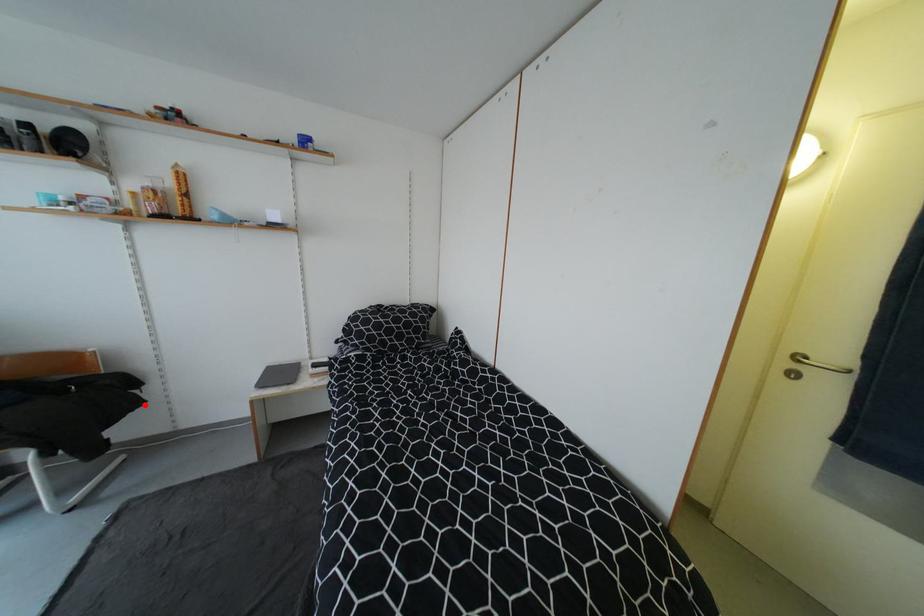
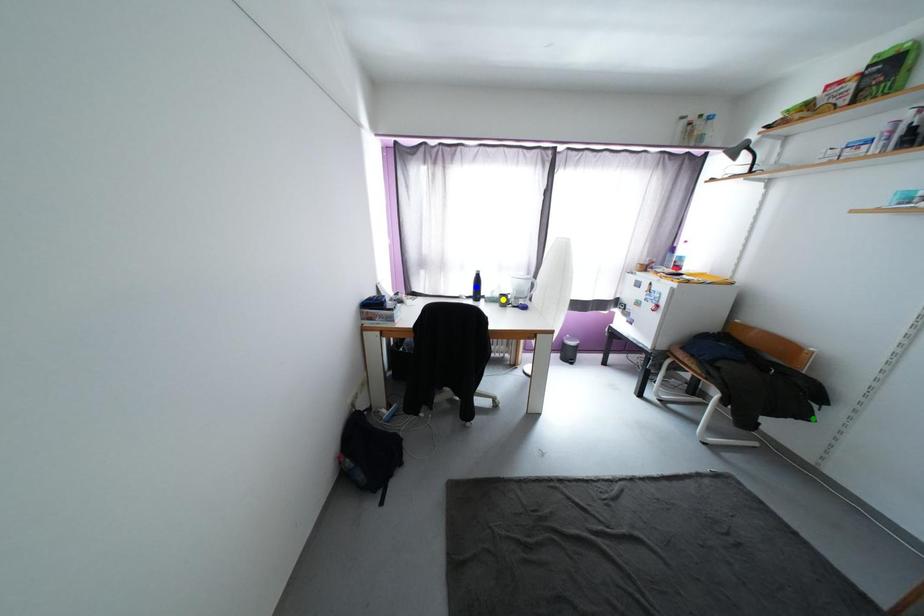
Question: I am providing you with two images of the same scene from different viewpoints. A red point is marked on the first image. You are given multiple points on the second image. Which mark in image 2 goes with the point in image 1?

Choices:
 (A) blue point
 (B) green point
 (C) yellow point

Answer: (B)